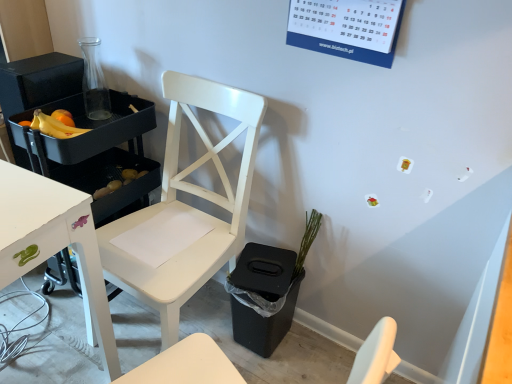
Question: From their relative heights in the image, would you say yellow matte potatoes at lower left is taller or shorter than yellow matte bananas at left?

Choices:
 (A) short
 (B) tall

Answer: (B)

Question: Considering the positions of point (123, 170) and point (73, 125), is point (123, 170) closer or farther from the camera than point (73, 125)?

Choices:
 (A) closer
 (B) farther

Answer: (B)

Question: Which of these objects is positioned farthest from the yellow matte bananas at left?

Choices:
 (A) yellow matte potatoes at lower left
 (B) green matte plant at lower center
 (C) white matte chair at center
 (D) black plastic houseplant at lower right

Answer: (B)

Question: Estimate the real-world distances between objects in this image. Which object is farther from the white matte chair at center?

Choices:
 (A) yellow matte potatoes at lower left
 (B) green matte plant at lower center
 (C) black plastic houseplant at lower right
 (D) yellow matte bananas at left

Answer: (D)